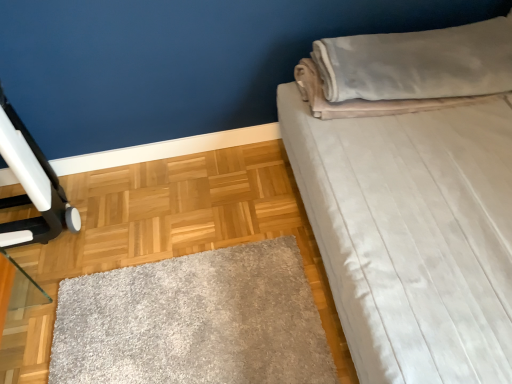
What do you see at coordinates (418, 63) in the screenshot? The image size is (512, 384). I see `velvet beige pillow at upper right` at bounding box center [418, 63].

What are the coordinates of `velvet beige pillow at upper right` in the screenshot? It's located at coord(418,63).

Where is `white soft bed at upper right`? white soft bed at upper right is located at coordinates (411, 196).

Describe the element at coordinates (411, 196) in the screenshot. I see `white soft bed at upper right` at that location.

What is the approximate height of white soft bed at upper right?

The height of white soft bed at upper right is 34.92 inches.

I want to click on velvet beige pillow at upper right, so click(418, 63).

Which object is positioned more to the right, velvet beige pillow at upper right or white soft bed at upper right?

white soft bed at upper right.

Is velvet beige pillow at upper right closer to camera compared to white soft bed at upper right?

No, velvet beige pillow at upper right is behind white soft bed at upper right.

Is point (358, 84) closer or farther from the camera than point (370, 331)?

Point (358, 84).

From the image's perspective, who appears lower, velvet beige pillow at upper right or white soft bed at upper right?

white soft bed at upper right.

From a real-world perspective, is velvet beige pillow at upper right located higher than white soft bed at upper right?

No, from a real-world perspective, velvet beige pillow at upper right is not on top of white soft bed at upper right.

Considering the sizes of velvet beige pillow at upper right and white soft bed at upper right in the image, is velvet beige pillow at upper right wider or thinner than white soft bed at upper right?

Clearly, velvet beige pillow at upper right has less width compared to white soft bed at upper right.

From the picture: In terms of height, does velvet beige pillow at upper right look taller or shorter compared to white soft bed at upper right?

Considering their sizes, velvet beige pillow at upper right has less height than white soft bed at upper right.

Is velvet beige pillow at upper right bigger than white soft bed at upper right?

No, velvet beige pillow at upper right is not bigger than white soft bed at upper right.

Does velvet beige pillow at upper right contain white soft bed at upper right?

No, white soft bed at upper right is not inside velvet beige pillow at upper right.

Are velvet beige pillow at upper right and white soft bed at upper right beside each other?

They are not placed beside each other.

Is velvet beige pillow at upper right looking in the opposite direction of white soft bed at upper right?

Yes.

Looking at this image, what's the angular difference between velvet beige pillow at upper right and white soft bed at upper right's facing directions?

The angular difference between velvet beige pillow at upper right and white soft bed at upper right is 88.3 degrees.

The image size is (512, 384). I want to click on pillow located above the white soft bed at upper right (from the image's perspective), so click(x=418, y=63).

Does white soft bed at upper right appear on the left side of velvet beige pillow at upper right?

No.

Is white soft bed at upper right in front of or behind velvet beige pillow at upper right in the image?

Visually, white soft bed at upper right is located in front of velvet beige pillow at upper right.

Is point (326, 44) closer or farther from the camera than point (379, 72)?

Point (326, 44) appears to be farther away from the viewer than point (379, 72).

Looking at this image, from the image's perspective, is white soft bed at upper right located above velvet beige pillow at upper right?

Incorrect, from the image's perspective, white soft bed at upper right is lower than velvet beige pillow at upper right.

From a real-world perspective, is white soft bed at upper right physically located above or below velvet beige pillow at upper right?

white soft bed at upper right is above velvet beige pillow at upper right.

Considering the sizes of objects white soft bed at upper right and velvet beige pillow at upper right in the image provided, who is thinner, white soft bed at upper right or velvet beige pillow at upper right?

With smaller width is velvet beige pillow at upper right.

Can you confirm if white soft bed at upper right is shorter than velvet beige pillow at upper right?

In fact, white soft bed at upper right may be taller than velvet beige pillow at upper right.

Can you confirm if white soft bed at upper right is bigger than velvet beige pillow at upper right?

Yes.

Is white soft bed at upper right completely or partially outside of velvet beige pillow at upper right?

Absolutely, white soft bed at upper right is external to velvet beige pillow at upper right.

Can you see white soft bed at upper right touching velvet beige pillow at upper right?

No, white soft bed at upper right is not touching velvet beige pillow at upper right.

Is white soft bed at upper right positioned with its back to velvet beige pillow at upper right?

Absolutely, white soft bed at upper right is directed away from velvet beige pillow at upper right.

In the image, there is a velvet beige pillow at upper right. Where is `bed below it (from the image's perspective)`? bed below it (from the image's perspective) is located at coordinates (411, 196).

You are a GUI agent. You are given a task and a screenshot of the screen. Output one action in this format:
    pyautogui.click(x=<x>, y=<y>)
    Task: Click on the pillow to the left of white soft bed at upper right
    
    Given the screenshot: What is the action you would take?
    pyautogui.click(x=418, y=63)

Locate an element on the screen. The width and height of the screenshot is (512, 384). pillow below the white soft bed at upper right (from a real-world perspective) is located at coordinates (418, 63).